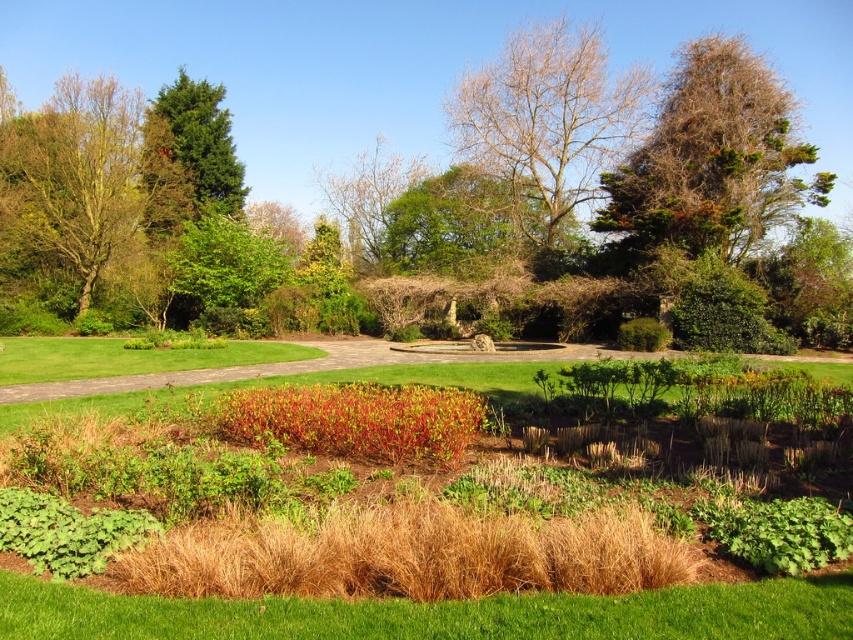
Does brown/dried wood tree at upper right have a greater height compared to bare branches at upper center?

No.

Between brown/dried wood tree at upper right and bare branches at upper center, which one has more height?

With more height is bare branches at upper center.

Is point (619, 262) farther from viewer compared to point (524, 195)?

No, it is in front of (524, 195).

The height and width of the screenshot is (640, 853). I want to click on brown/dried wood tree at upper right, so click(x=711, y=161).

Is green glossy tree at upper left bigger than bare branches at center?

Yes, green glossy tree at upper left is bigger than bare branches at center.

Measure the distance between green glossy tree at upper left and camera.

green glossy tree at upper left and camera are 42.73 meters apart from each other.

Where is `green glossy tree at upper left`? The height and width of the screenshot is (640, 853). green glossy tree at upper left is located at coordinates (189, 156).

Is point (94, 605) behind point (22, 138)?

No, (94, 605) is in front of (22, 138).

At what (x,y) coordinates should I click in order to perform the action: click on green grass at lower center. Please return your answer as a coordinate pair (x, y). Looking at the image, I should click on (439, 612).

At what (x,y) coordinates should I click in order to perform the action: click on green grass at lower center. Please return your answer as a coordinate pair (x, y). Image resolution: width=853 pixels, height=640 pixels. Looking at the image, I should click on (439, 612).